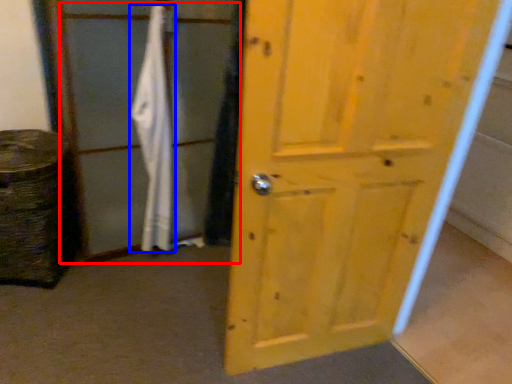
Question: Which object is further to the camera taking this photo, screen door (highlighted by a red box) or bath towel (highlighted by a blue box)?

Choices:
 (A) screen door
 (B) bath towel

Answer: (B)